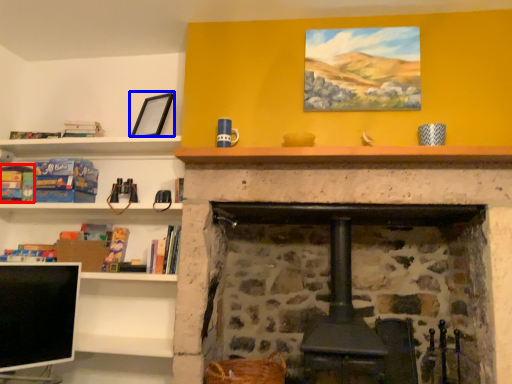
Question: Among these objects, which one is nearest to the camera, book (highlighted by a red box) or picture frame (highlighted by a blue box)?

Choices:
 (A) book
 (B) picture frame

Answer: (B)